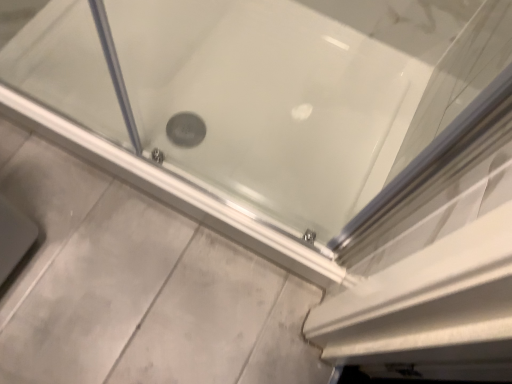
The height and width of the screenshot is (384, 512). What do you see at coordinates (137, 287) in the screenshot?
I see `white matte concrete at lower center` at bounding box center [137, 287].

You are a GUI agent. You are given a task and a screenshot of the screen. Output one action in this format:
    pyautogui.click(x=<x>, y=<y>)
    Task: Click on the white matte concrete at lower center
    
    Given the screenshot: What is the action you would take?
    pyautogui.click(x=137, y=287)

Measure the distance between point [44,277] and camera.

The depth of point [44,277] is 1.17 meters.

In order to click on white matte concrete at lower center in this screenshot , I will do `click(137, 287)`.